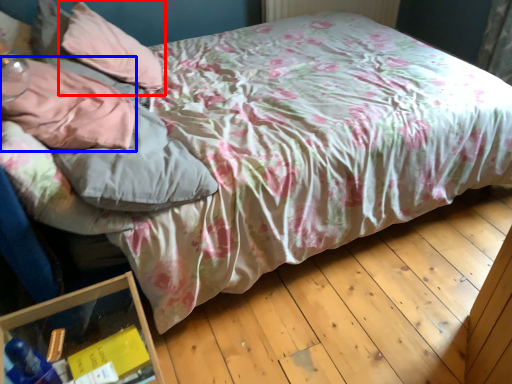
Question: Which point is further to the camera, pillow (highlighted by a red box) or pillow (highlighted by a blue box)?

Choices:
 (A) pillow
 (B) pillow

Answer: (A)